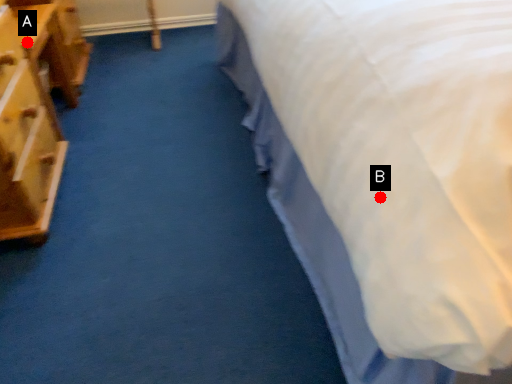
Question: Two points are circled on the image, labeled by A and B beside each circle. Which point is closer to the camera taking this photo?

Choices:
 (A) A is closer
 (B) B is closer

Answer: (B)